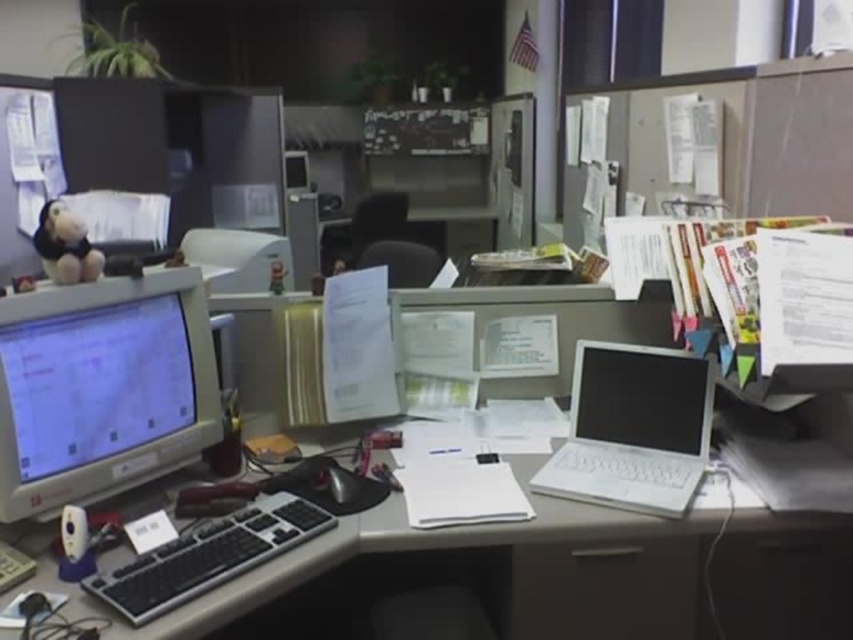
Does matte gray monitor at left lie in front of matte black laptop at center?

Yes, matte gray monitor at left is closer to the viewer.

Describe the element at coordinates (102, 388) in the screenshot. I see `matte gray monitor at left` at that location.

Find the location of `matte gray monitor at left`. matte gray monitor at left is located at coordinates (102, 388).

Which of these two, white plastic laptop at right or black plastic keyboard at center, stands shorter?

Standing shorter between the two is black plastic keyboard at center.

How far apart are white plastic laptop at right and black plastic keyboard at center?

They are 27.20 inches apart.

At what (x,y) coordinates should I click in order to perform the action: click on white plastic laptop at right. Please return your answer as a coordinate pair (x, y). The height and width of the screenshot is (640, 853). Looking at the image, I should click on pyautogui.click(x=633, y=429).

This screenshot has height=640, width=853. Find the location of `white plastic laptop at right`. white plastic laptop at right is located at coordinates (633, 429).

Is white plastic computer desk at center wider than white plastic laptop at right?

Correct, the width of white plastic computer desk at center exceeds that of white plastic laptop at right.

In the scene shown: Which is below, white plastic computer desk at center or white plastic laptop at right?

white plastic computer desk at center is below.

Is point (407, 550) closer to camera compared to point (701, 420)?

Yes, it is.

Identify the location of white plastic computer desk at center. This screenshot has width=853, height=640. (466, 577).